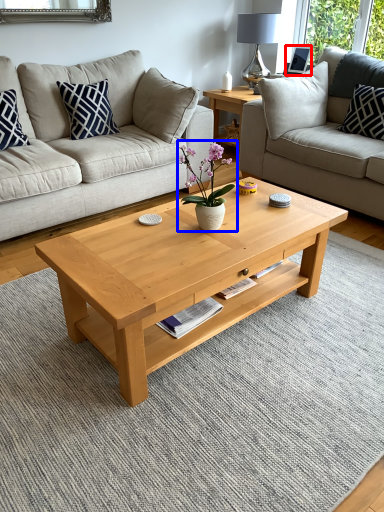
Question: Among these objects, which one is nearest to the camera, picture frame (highlighted by a red box) or houseplant (highlighted by a blue box)?

Choices:
 (A) picture frame
 (B) houseplant

Answer: (B)